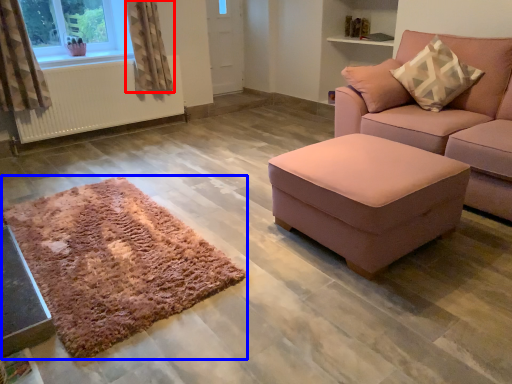
Question: Which point is closer to the camera, curtain (highlighted by a red box) or mat (highlighted by a blue box)?

Choices:
 (A) curtain
 (B) mat

Answer: (B)